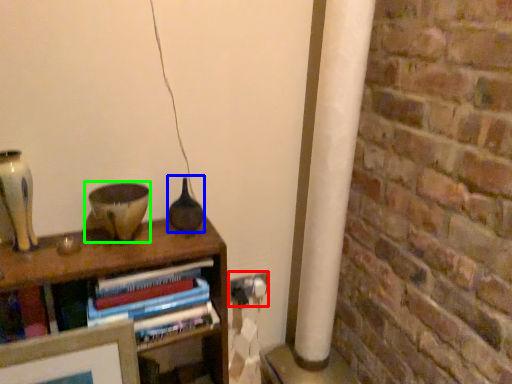
Question: Estimate the real-world distances between objects in this image. Which object is farther from electric outlet (highlighted by a red box), glass vase (highlighted by a blue box) or candle holder (highlighted by a green box)?

Choices:
 (A) glass vase
 (B) candle holder

Answer: (B)